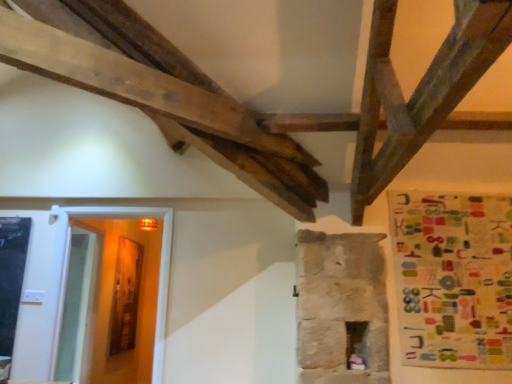
Question: Considering their positions, is multicolored fabric poster at right located in front of or behind transparent glass door at lower left?

Choices:
 (A) front
 (B) behind

Answer: (A)

Question: Is multicolored fabric poster at right wider or thinner than transparent glass door at lower left?

Choices:
 (A) wide
 (B) thin

Answer: (B)

Question: From the image's perspective, is multicolored fabric poster at right above or below transparent glass door at lower left?

Choices:
 (A) below
 (B) above

Answer: (B)

Question: From their relative heights in the image, would you say transparent glass door at lower left is taller or shorter than multicolored fabric poster at right?

Choices:
 (A) short
 (B) tall

Answer: (B)

Question: From a real-world perspective, is transparent glass door at lower left above or below multicolored fabric poster at right?

Choices:
 (A) above
 (B) below

Answer: (B)

Question: Considering the positions of transparent glass door at lower left and multicolored fabric poster at right in the image, is transparent glass door at lower left wider or thinner than multicolored fabric poster at right?

Choices:
 (A) thin
 (B) wide

Answer: (B)

Question: In terms of size, does transparent glass door at lower left appear bigger or smaller than multicolored fabric poster at right?

Choices:
 (A) big
 (B) small

Answer: (A)